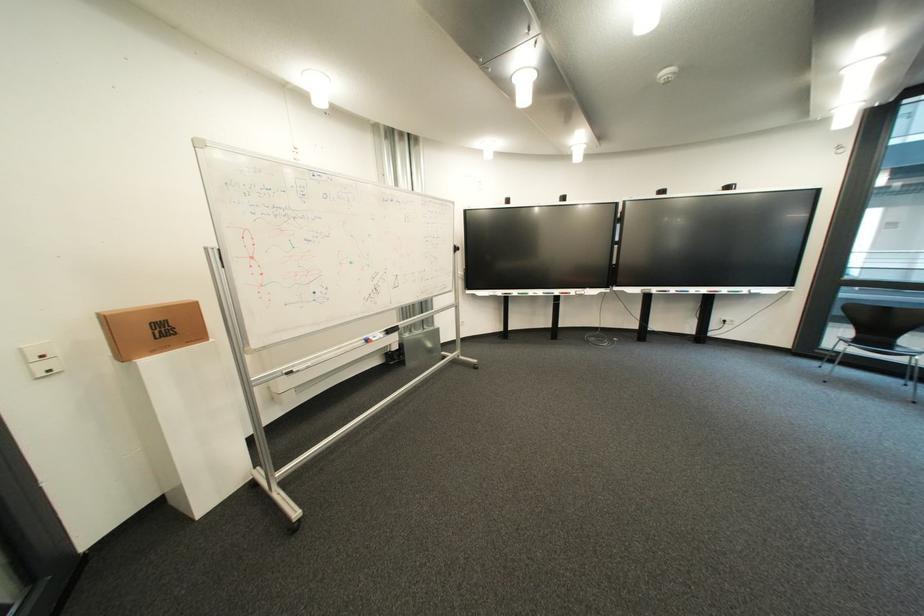
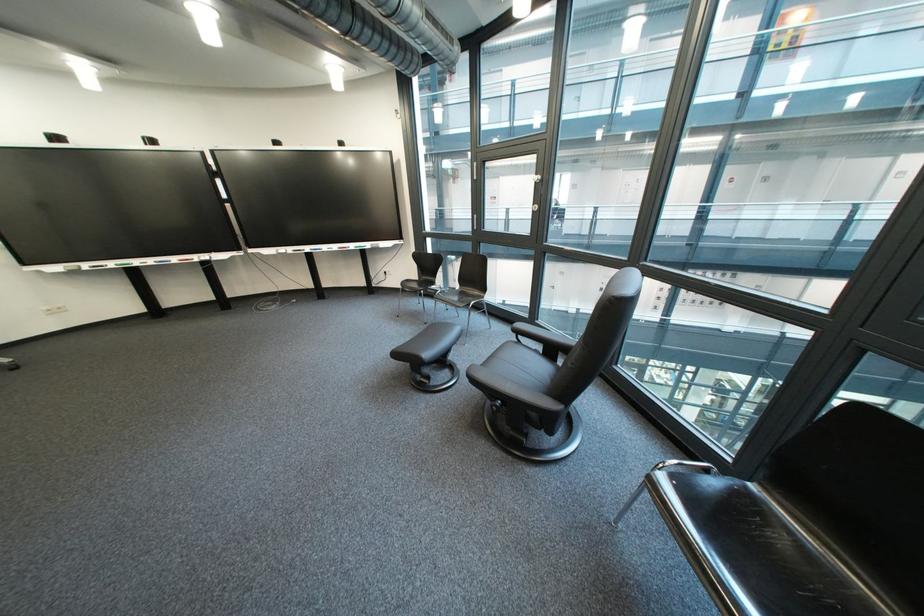
Question: Which direction would the cameraman need to move to produce the second image? Reply with the corresponding letter.

Choices:
 (A) Left
 (B) Right
 (C) Forward
 (D) Backward

Answer: (B)